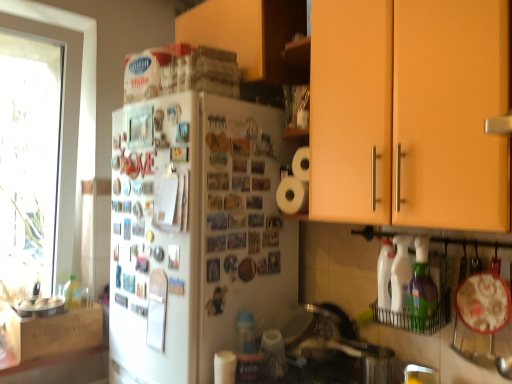
Question: From the image's perspective, does white matte refrigerator at center appear lower than matte orange cabinet at upper right, the second cabinetry ordered from the bottom?

Choices:
 (A) yes
 (B) no

Answer: (A)

Question: Does white matte refrigerator at center come in front of matte orange cabinet at upper right, the third cabinetry positioned from the left?

Choices:
 (A) yes
 (B) no

Answer: (B)

Question: From the image's perspective, is white matte refrigerator at center located above matte orange cabinet at upper right, placed as the second cabinetry when sorted from top to bottom?

Choices:
 (A) yes
 (B) no

Answer: (B)

Question: Is there a large distance between white matte refrigerator at center and matte orange cabinet at upper right, the first cabinetry from the right?

Choices:
 (A) yes
 (B) no

Answer: (B)

Question: Is white matte refrigerator at center oriented towards matte orange cabinet at upper right, placed as the second cabinetry when sorted from top to bottom?

Choices:
 (A) no
 (B) yes

Answer: (A)

Question: Does white matte refrigerator at center have a larger size compared to matte orange cabinet at upper right, the third cabinetry positioned from the left?

Choices:
 (A) no
 (B) yes

Answer: (B)

Question: Is wooden cabinet at upper center, acting as the third cabinetry starting from the bottom, shorter than white matte refrigerator at center?

Choices:
 (A) no
 (B) yes

Answer: (B)

Question: From a real-world perspective, is wooden cabinet at upper center, marked as the first cabinetry in a top-to-bottom arrangement, positioned under white matte refrigerator at center based on gravity?

Choices:
 (A) yes
 (B) no

Answer: (B)

Question: Does wooden cabinet at upper center, marked as the first cabinetry in a top-to-bottom arrangement, have a larger size compared to white matte refrigerator at center?

Choices:
 (A) no
 (B) yes

Answer: (A)

Question: Is wooden cabinet at upper center, marked as the first cabinetry in a top-to-bottom arrangement, further to camera compared to white matte refrigerator at center?

Choices:
 (A) no
 (B) yes

Answer: (B)

Question: Is the depth of wooden cabinet at upper center, acting as the third cabinetry starting from the bottom, less than that of white matte refrigerator at center?

Choices:
 (A) no
 (B) yes

Answer: (A)

Question: Is wooden cabinet at upper center, the 2th cabinetry in the right-to-left sequence, placed right next to white matte refrigerator at center?

Choices:
 (A) no
 (B) yes

Answer: (A)

Question: From a real-world perspective, is white matte paper towel at lower center on wooden crate at left, which is counted as the 1th cabinetry, starting from the left?

Choices:
 (A) yes
 (B) no

Answer: (B)